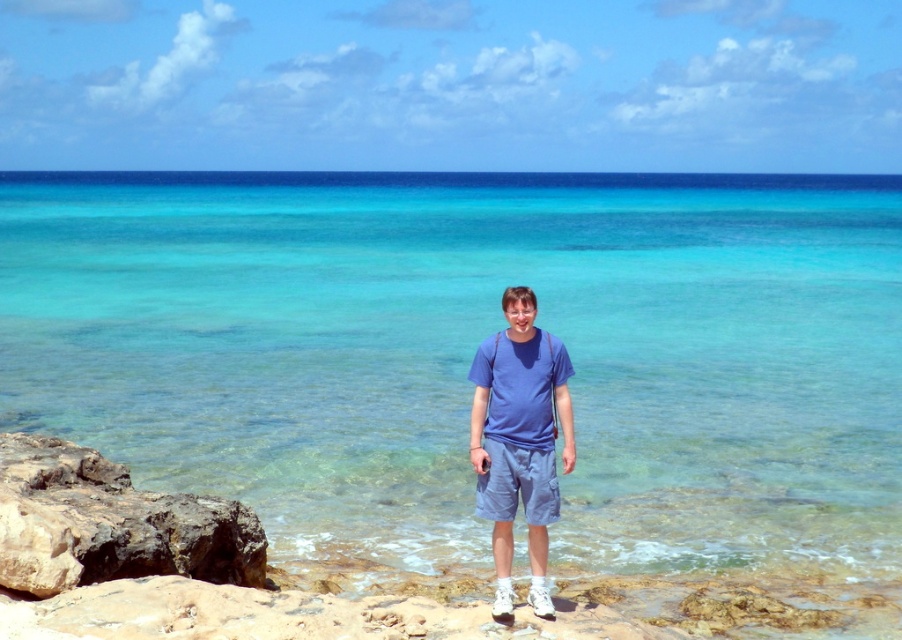
Question: Considering the relative positions of dark gray rock at lower left and blue cotton shirt at center in the image provided, where is dark gray rock at lower left located with respect to blue cotton shirt at center?

Choices:
 (A) below
 (B) above

Answer: (A)

Question: Which is nearer to the dark gray rock at lower left?

Choices:
 (A) blue cotton shirt at center
 (B) clear blue water at center

Answer: (A)

Question: Is clear blue water at center further to camera compared to blue cotton shirt at center?

Choices:
 (A) no
 (B) yes

Answer: (B)

Question: Considering the real-world distances, which object is closest to the dark gray rock at lower left?

Choices:
 (A) blue cotton shirt at center
 (B) clear blue water at center

Answer: (A)

Question: Can you confirm if clear blue water at center is positioned below blue cotton shirt at center?

Choices:
 (A) no
 (B) yes

Answer: (A)

Question: Among these objects, which one is nearest to the camera?

Choices:
 (A) blue cotton shirt at center
 (B) dark gray rock at lower left
 (C) clear blue water at center

Answer: (B)